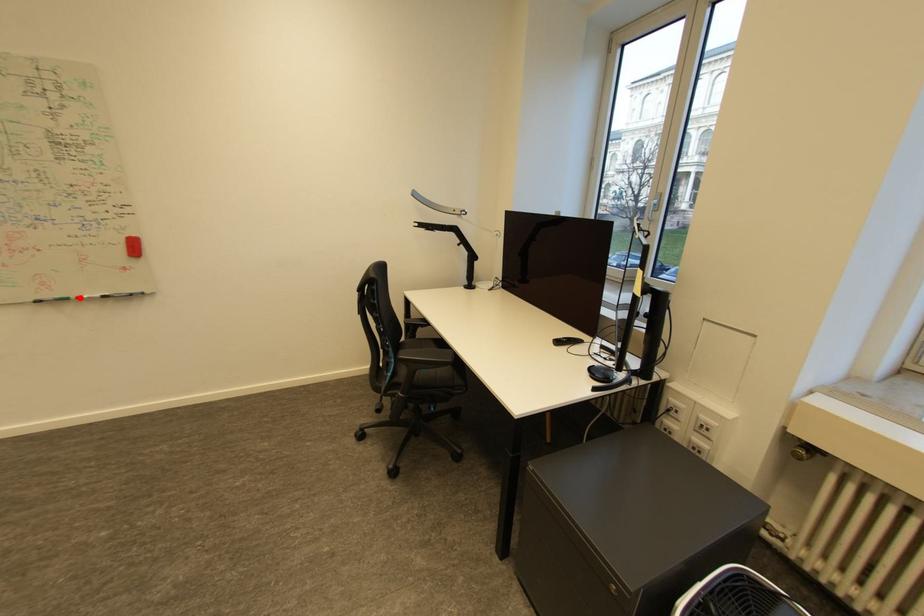
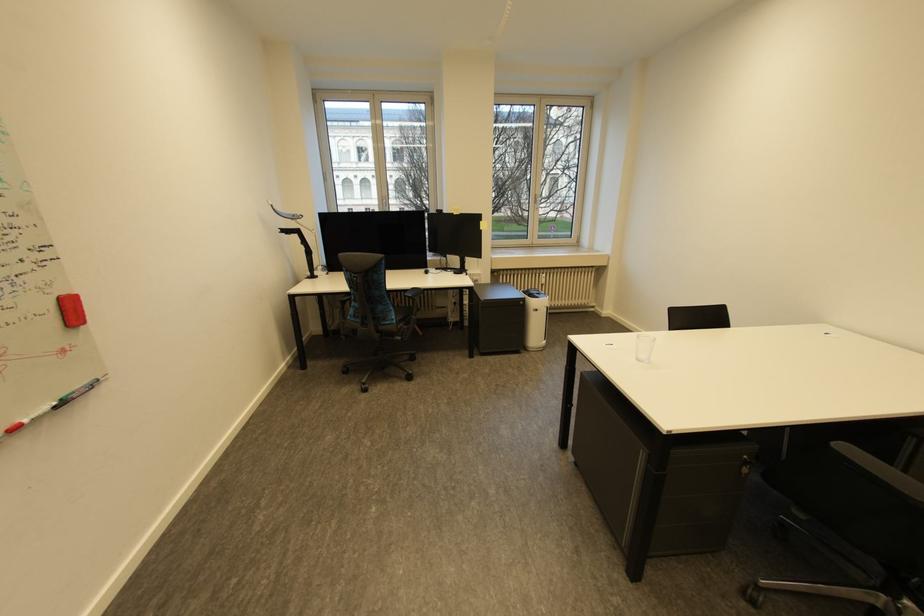
Question: I am providing you with two images of the same scene from different viewpoints. Image1 has a red point marked. In image2, the corresponding 3D location appears at what relative position? Reply with the corresponding letter.

Choices:
 (A) Closer
 (B) Farther

Answer: (B)